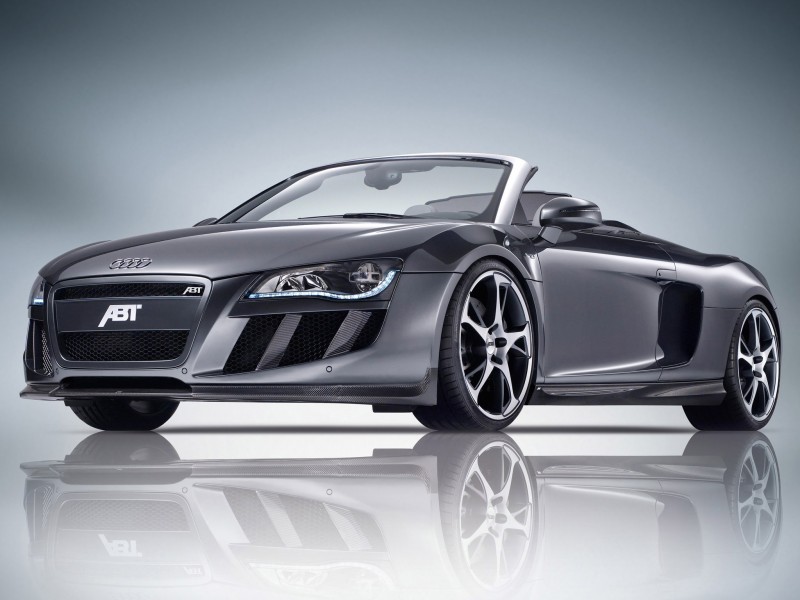
The image size is (800, 600). I want to click on front window, so click(410, 180).